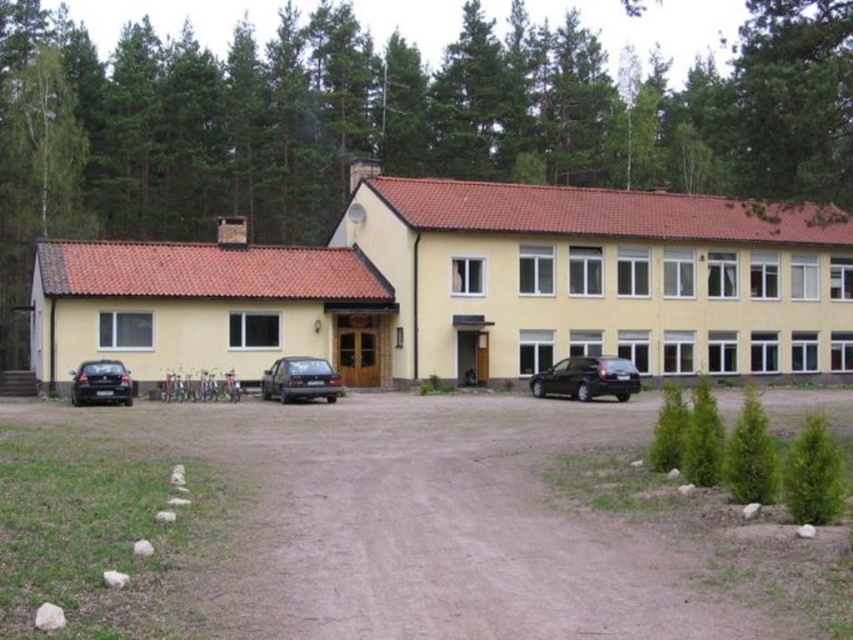
Where is `black matte car at center`? black matte car at center is located at coordinates [587, 378].

Is black matte car at center closer to camera compared to shiny black car at lower left?

That is False.

Is point (602, 376) closer to camera compared to point (122, 365)?

No, it is not.

This screenshot has width=853, height=640. I want to click on black matte car at center, so tap(587, 378).

Does point (553, 368) come in front of point (314, 372)?

That is False.

Does black matte car at center lie behind satin black hatchback at center?

Yes, it is behind satin black hatchback at center.

Identify the location of black matte car at center. (587, 378).

I want to click on satin black hatchback at center, so click(300, 380).